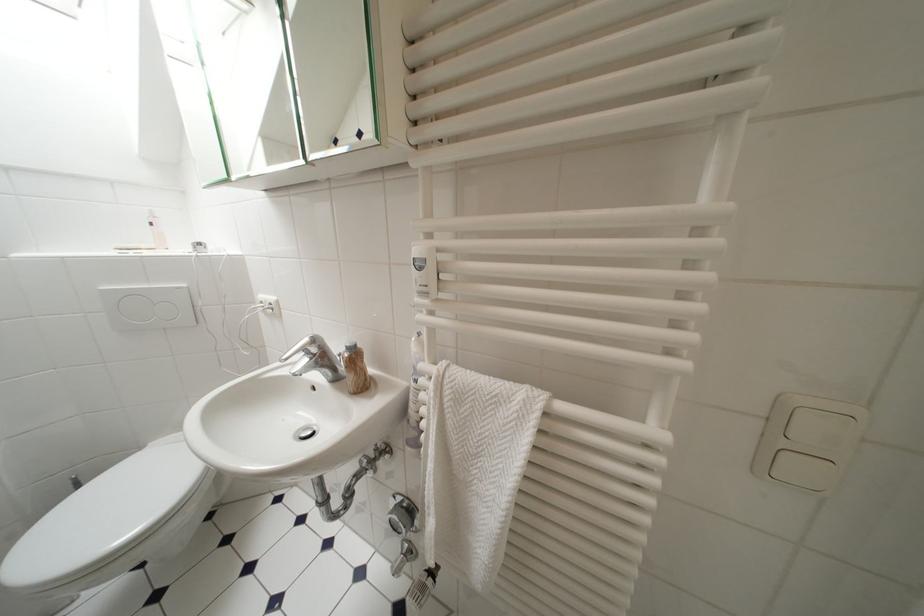
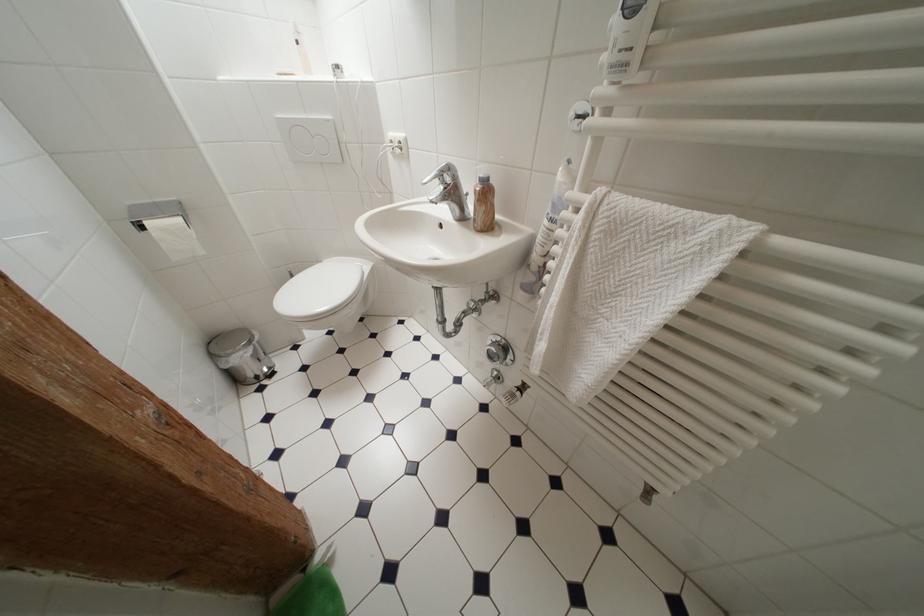
The point at (346, 358) is marked in the first image. Where is the corresponding point in the second image?

(473, 197)